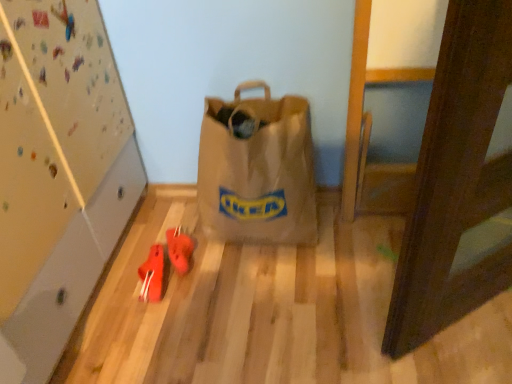
The width and height of the screenshot is (512, 384). In order to click on vacant area that is in front of brown paper bag at center in this screenshot , I will do `click(262, 305)`.